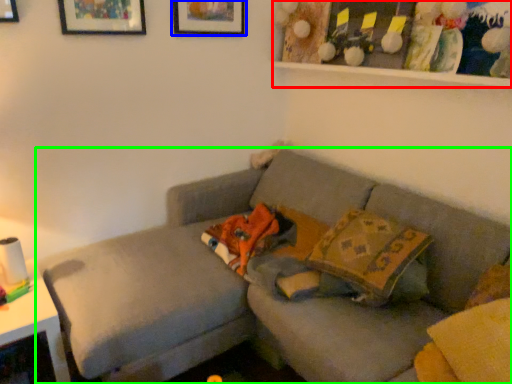
Question: Considering the real-world distances, which object is closest to shelf (highlighted by a red box)? picture frame (highlighted by a blue box) or studio couch (highlighted by a green box).

Choices:
 (A) picture frame
 (B) studio couch

Answer: (A)